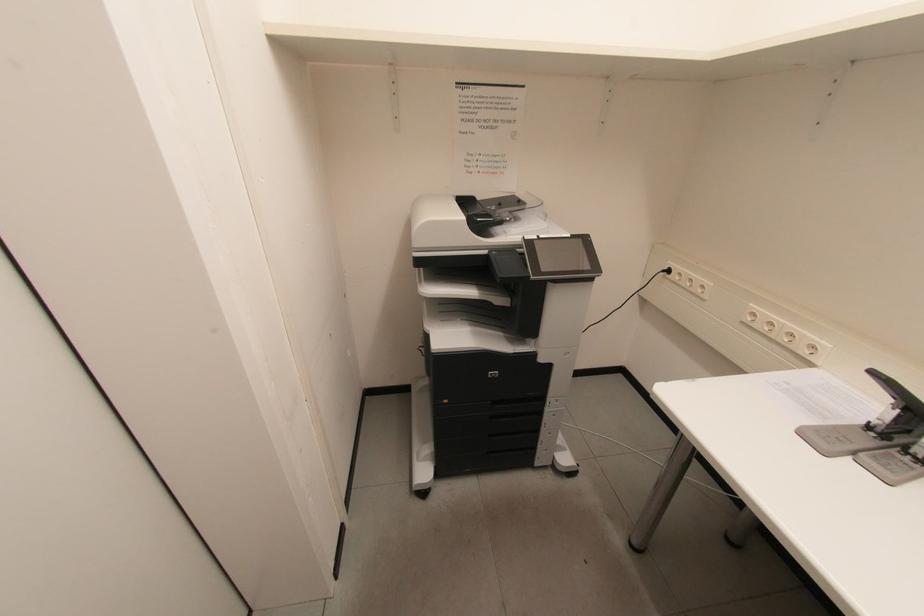
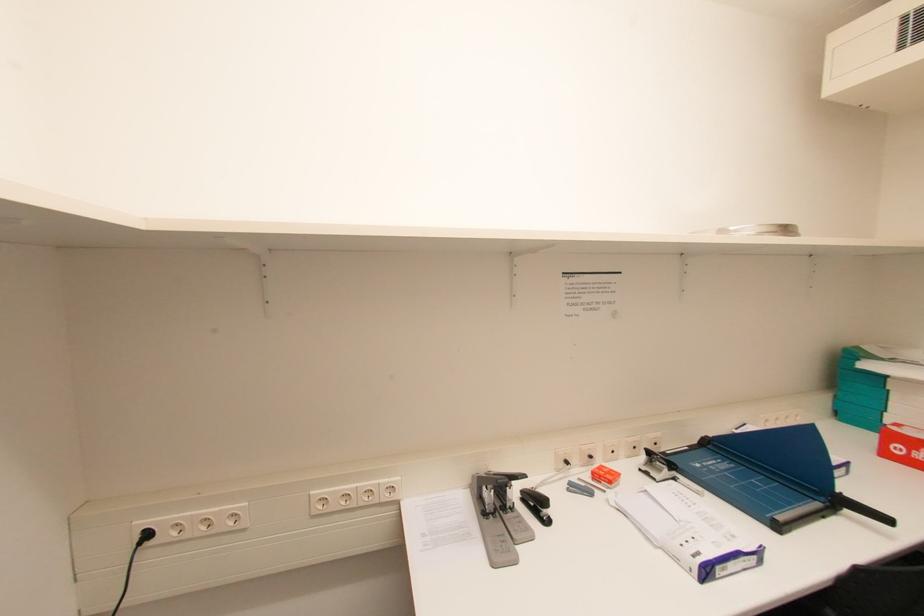
Question: The camera is either moving clockwise (left) or counter-clockwise (right) around the object. The first image is from the beginning of the video and the second image is from the end. Is the camera moving left or right when shooting the video?

Choices:
 (A) Left
 (B) Right

Answer: (A)